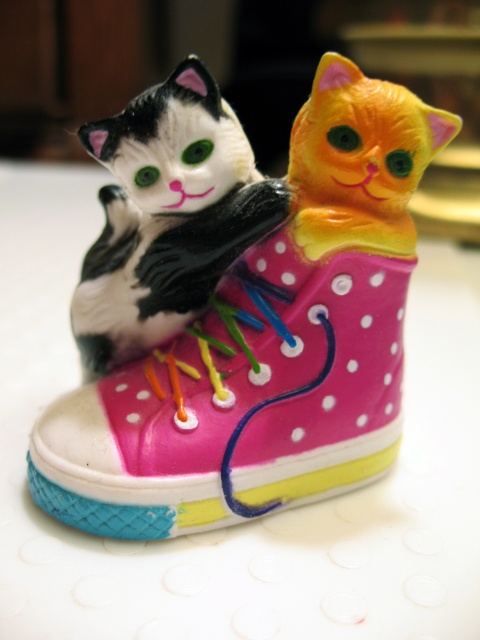
You are a small toy mouse that is 1 inch long. You want to hide between the pink polka dot shoe at center and the matte black cat at center. Is there enough space for you to hide there?

The distance between the pink polka dot shoe at center and the matte black cat at center is 4.98 inches, so yes, the toy mouse can hide between them since it is longer than the mouse.

You are a cat owner who wants to place a new pink polka dot shoe at center on the floor next to your matte black cat at center. Based on the scene description, will the shoe be visible underneath the cat?

The pink polka dot shoe at center is positioned under matte black cat at center, so yes, the shoe will be visible underneath the cat.

You are a cat owner who wants to place your matte black cat at center on a shelf next to a pink polka dot shoe at center. Based on the scene, which object should be placed on the left side of the shelf?

The matte black cat at center should be placed on the left side of the shelf because the pink polka dot shoe at center is to the right of it in the scene.